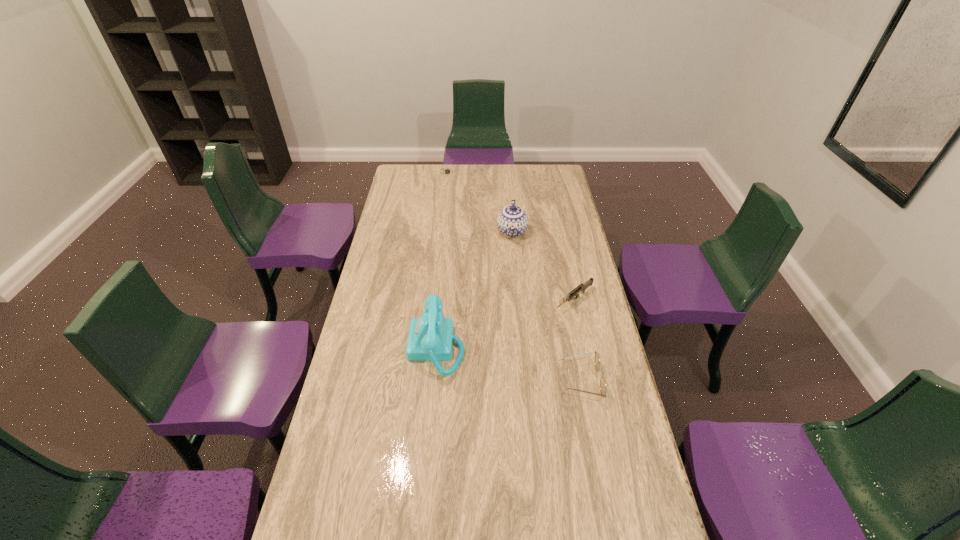
Locate an element on the screen. telephone is located at coordinates (430, 338).

This screenshot has height=540, width=960. In order to click on spectacles in this screenshot , I will do `click(597, 359)`.

Locate an element on the screen. the third nearest object is located at coordinates (582, 287).

Identify the location of the farthest object. (447, 171).

Image resolution: width=960 pixels, height=540 pixels. What are the coordinates of `watch` in the screenshot? It's located at (x=447, y=171).

Find the location of a particular element. Image resolution: width=960 pixels, height=540 pixels. the third object from left to right is located at coordinates (512, 221).

At what (x,y) coordinates should I click in order to perform the action: click on chinaware. Please return your answer as a coordinate pair (x, y). This screenshot has height=540, width=960. Looking at the image, I should click on (512, 221).

Locate an element on the screen. The image size is (960, 540). free point located on the dial of the telephone is located at coordinates (376, 347).

The width and height of the screenshot is (960, 540). Find the location of `vacant space situated 0.120m on the dial of the telephone`. vacant space situated 0.120m on the dial of the telephone is located at coordinates (373, 347).

This screenshot has width=960, height=540. What are the coordinates of `free space located on the dial of the telephone` in the screenshot? It's located at (368, 347).